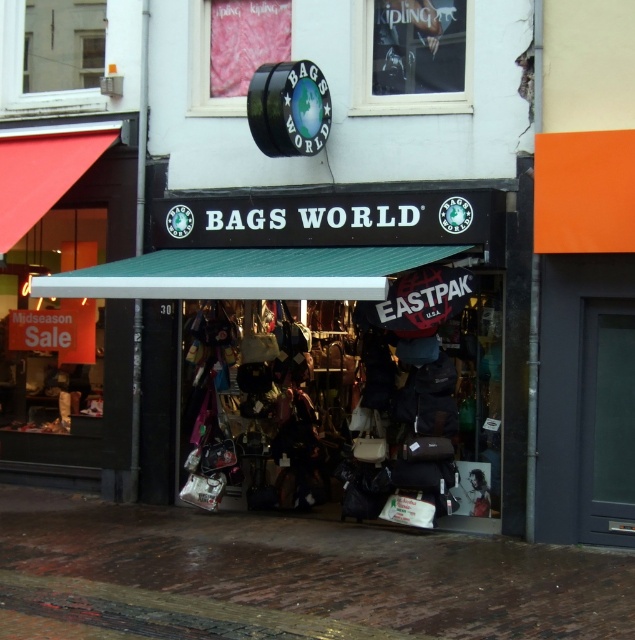
Question: Which of the following is the farthest from the observer?

Choices:
 (A) (485, 600)
 (B) (203, 394)

Answer: (B)

Question: Where is matte black awning at center located in relation to brown brick pavement at lower center in the image?

Choices:
 (A) right
 (B) left

Answer: (A)

Question: Does matte black awning at center have a smaller size compared to brown brick pavement at lower center?

Choices:
 (A) no
 (B) yes

Answer: (A)

Question: Which of the following is the farthest from the observer?

Choices:
 (A) (608, 625)
 (B) (436, 486)

Answer: (B)

Question: From the image, what is the correct spatial relationship of matte black awning at center in relation to brown brick pavement at lower center?

Choices:
 (A) right
 (B) left

Answer: (A)